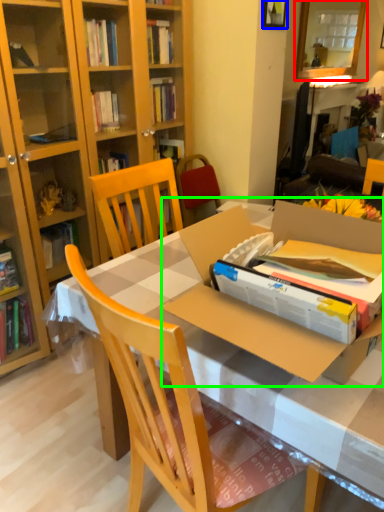
Question: Which object is the closest to the mirror (highlighted by a red box)? Choose among these: picture frame (highlighted by a blue box) or cardboard box (highlighted by a green box).

Choices:
 (A) picture frame
 (B) cardboard box

Answer: (A)